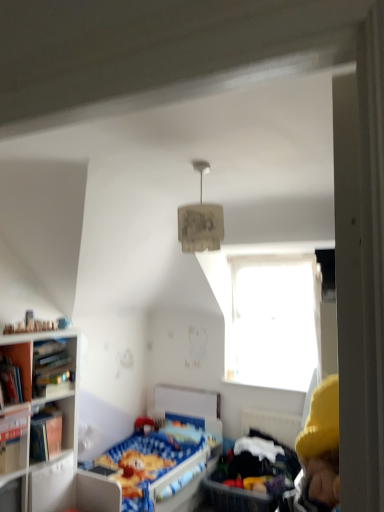
Question: Considering the relative sizes of transparent glass window at upper center and wooden bookshelf at left in the image provided, is transparent glass window at upper center smaller than wooden bookshelf at left?

Choices:
 (A) yes
 (B) no

Answer: (B)

Question: Is there a large distance between transparent glass window at upper center and wooden bookshelf at left?

Choices:
 (A) no
 (B) yes

Answer: (B)

Question: Is transparent glass window at upper center shorter than wooden bookshelf at left?

Choices:
 (A) yes
 (B) no

Answer: (B)

Question: Considering the relative sizes of transparent glass window at upper center and wooden bookshelf at left in the image provided, is transparent glass window at upper center taller than wooden bookshelf at left?

Choices:
 (A) yes
 (B) no

Answer: (A)

Question: Is transparent glass window at upper center to the left of wooden bookshelf at left from the viewer's perspective?

Choices:
 (A) no
 (B) yes

Answer: (A)

Question: Is point 0,428 positioned closer to the camera than point 8,350?

Choices:
 (A) farther
 (B) closer

Answer: (B)

Question: Which is correct: hardcover book at left, which is the 1th book from bottom to top, is inside wooden bookshelf at left, or outside of it?

Choices:
 (A) inside
 (B) outside

Answer: (B)

Question: Is hardcover book at left, placed as the second book when sorted from top to bottom, wider or thinner than wooden bookshelf at left?

Choices:
 (A) thin
 (B) wide

Answer: (A)

Question: In the image, is hardcover book at left, which is the 1th book from bottom to top, positioned in front of or behind wooden bookshelf at left?

Choices:
 (A) front
 (B) behind

Answer: (A)

Question: Based on their sizes in the image, would you say hardcover book at left, placed as the second book when sorted from top to bottom, is bigger or smaller than wooden bookshelf at left?

Choices:
 (A) small
 (B) big

Answer: (A)

Question: From a real-world perspective, is hardcover book at left, which is the 1th book from bottom to top, above or below wooden bookshelf at left?

Choices:
 (A) below
 (B) above

Answer: (B)

Question: Is hardcover book at left, placed as the second book when sorted from top to bottom, in front of or behind wooden bookshelf at left in the image?

Choices:
 (A) behind
 (B) front

Answer: (A)

Question: Is hardcover book at left, which is the 1th book from bottom to top, wider or thinner than wooden bookshelf at left?

Choices:
 (A) thin
 (B) wide

Answer: (A)

Question: Is transparent glass window at upper center in front of or behind blue fabric infant bed at lower right in the image?

Choices:
 (A) front
 (B) behind

Answer: (B)

Question: Considering the positions of transparent glass window at upper center and blue fabric infant bed at lower right in the image, is transparent glass window at upper center wider or thinner than blue fabric infant bed at lower right?

Choices:
 (A) thin
 (B) wide

Answer: (A)